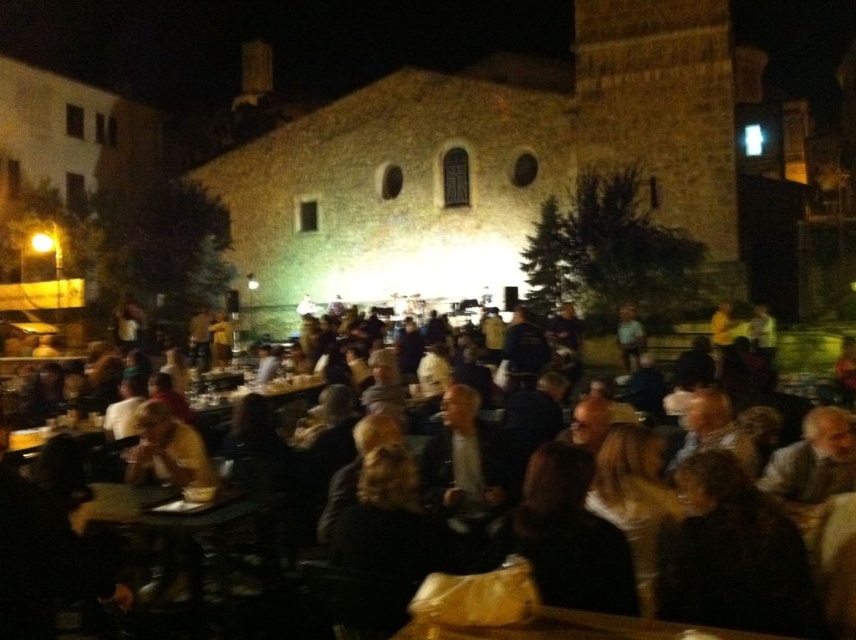
Question: Can you confirm if dark brown leather chairs at center is positioned to the left of wooden table at lower left?

Choices:
 (A) yes
 (B) no

Answer: (B)

Question: Which point is closer to the camera taking this photo?

Choices:
 (A) (187, 528)
 (B) (664, 339)

Answer: (A)

Question: Is dark brown leather chairs at center to the left of wooden table at lower left from the viewer's perspective?

Choices:
 (A) no
 (B) yes

Answer: (A)

Question: Which object appears closest to the camera in this image?

Choices:
 (A) dark brown leather chairs at center
 (B) wooden table at lower left

Answer: (B)

Question: Can you confirm if dark brown leather chairs at center is positioned to the right of wooden table at lower left?

Choices:
 (A) yes
 (B) no

Answer: (A)